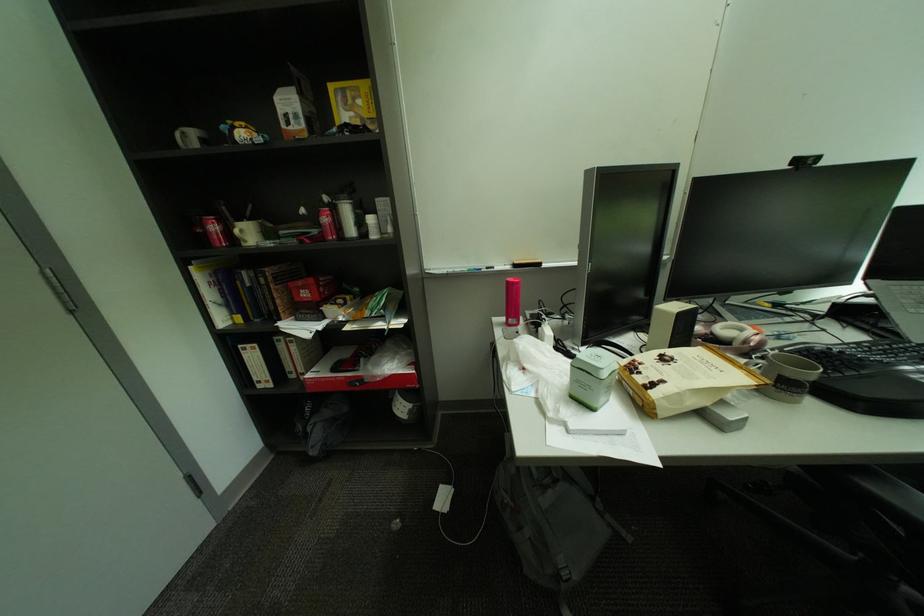
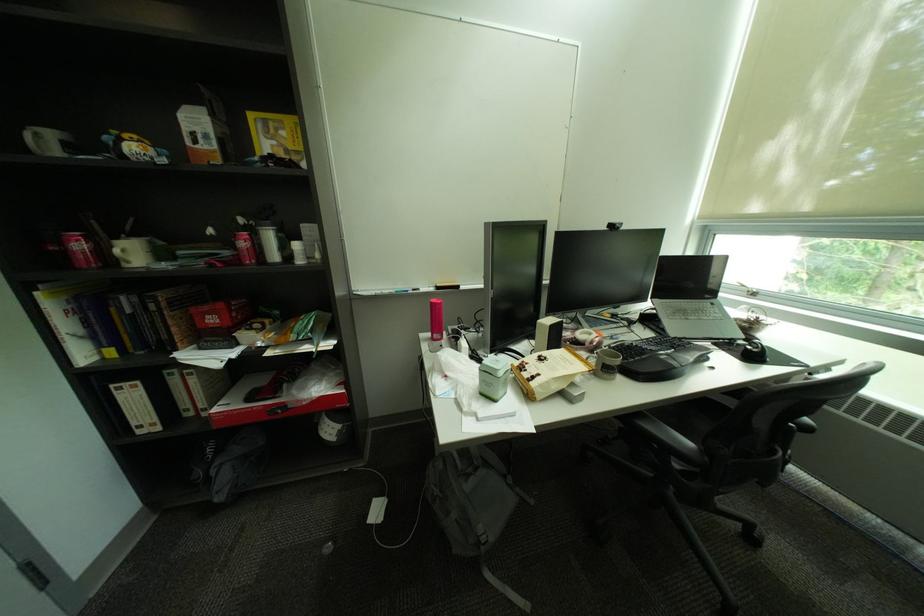
The point at (808, 161) is marked in the first image. Where is the corresponding point in the second image?

(621, 227)